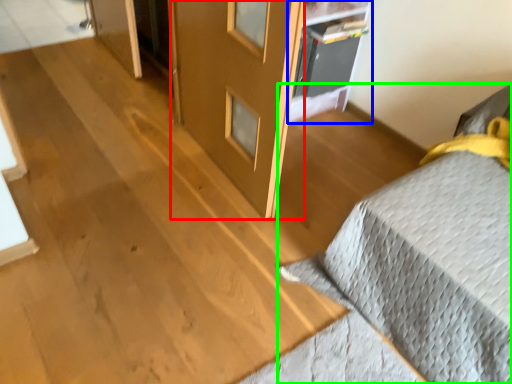
Question: Which is nearer to the screen door (highlighted by a red box)? shelf (highlighted by a blue box) or furniture (highlighted by a green box).

Choices:
 (A) shelf
 (B) furniture

Answer: (A)